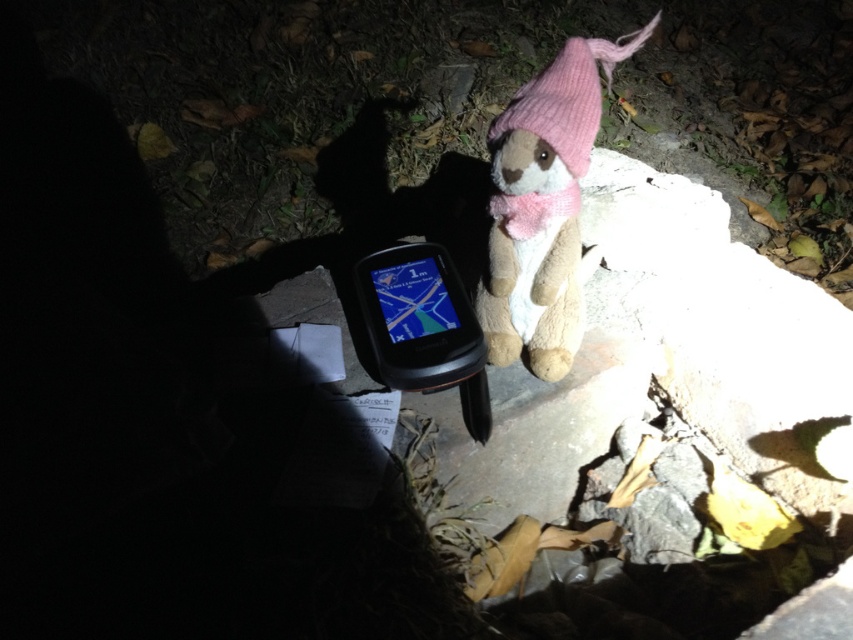
Question: Which point is closer to the camera taking this photo?

Choices:
 (A) (550, 230)
 (B) (422, 390)
 (C) (521, 104)

Answer: (C)

Question: Does soft pink knit hat at upper right appear on the right side of black plastic phone at center?

Choices:
 (A) yes
 (B) no

Answer: (A)

Question: Is soft pink knit hat at upper right below pink knitted hat at upper right?

Choices:
 (A) yes
 (B) no

Answer: (A)

Question: Which object is farther from the camera taking this photo?

Choices:
 (A) pink knitted hat at upper right
 (B) soft pink knit hat at upper right

Answer: (A)

Question: Considering the real-world distances, which object is farthest from the black plastic phone at center?

Choices:
 (A) pink knitted hat at upper right
 (B) soft pink knit hat at upper right

Answer: (A)

Question: Is soft pink knit hat at upper right in front of black plastic phone at center?

Choices:
 (A) yes
 (B) no

Answer: (A)